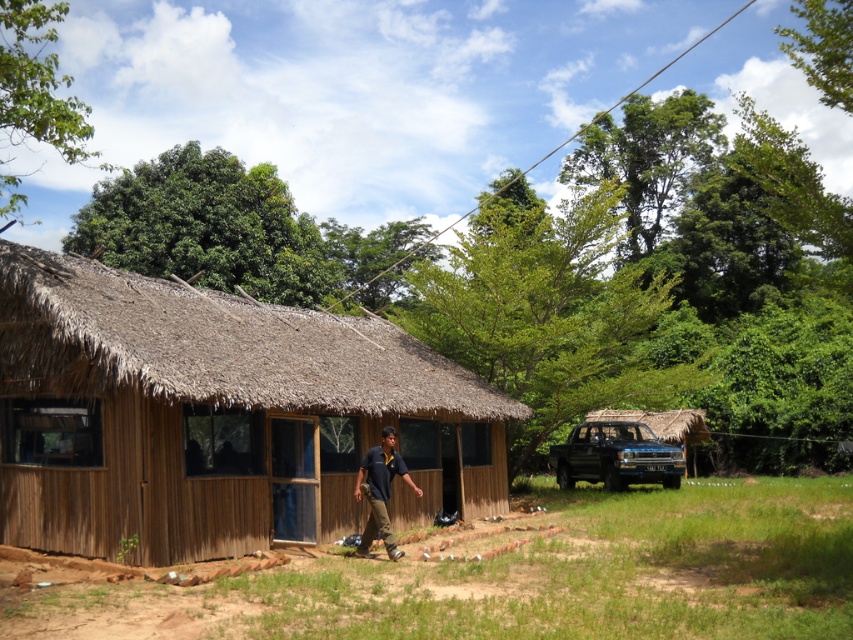
You are standing in front of the rustic wooden hut and notice the brown thatch at center and the dark brown uniform at center. Which object is higher in height?

The brown thatch at center is taller than the dark brown uniform at center.